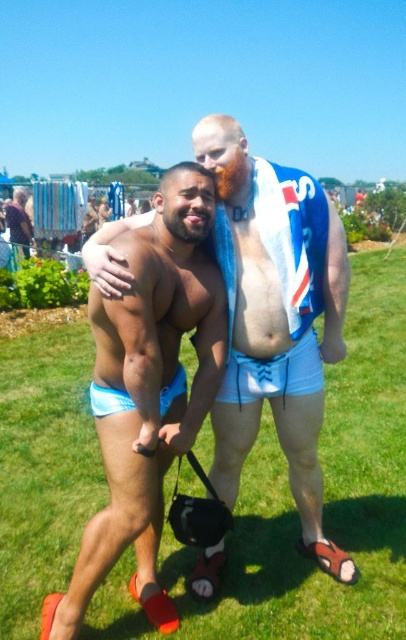
Is green grass at center taller than blue fabric shorts at center?

Incorrect, green grass at center's height is not larger of blue fabric shorts at center's.

Which is above, green grass at center or blue fabric shorts at center?

Positioned higher is blue fabric shorts at center.

Who is more distant from viewer, (339, 490) or (129, 435)?

The point (339, 490) is more distant.

Find the location of `green grass at center`. green grass at center is located at coordinates (295, 508).

Find the location of a particular element. matte white shorts at center is located at coordinates (276, 317).

Between point (244, 378) and point (237, 362), which one is positioned behind?

Point (244, 378)

What do you see at coordinates (276, 317) in the screenshot?
I see `matte white shorts at center` at bounding box center [276, 317].

Where is `matte white shorts at center`? matte white shorts at center is located at coordinates (276, 317).

Consider the image. Does blue fabric shorts at center have a larger size compared to white fabric shorts at center?

Correct, blue fabric shorts at center is larger in size than white fabric shorts at center.

Which is in front, point (140, 483) or point (248, 385)?

Point (140, 483) is in front.

At what (x,y) coordinates should I click in order to perform the action: click on blue fabric shorts at center. Please return your answer as a coordinate pair (x, y). The image size is (406, 640). Looking at the image, I should click on (148, 392).

Where is `blue fabric shorts at center`? blue fabric shorts at center is located at coordinates (148, 392).